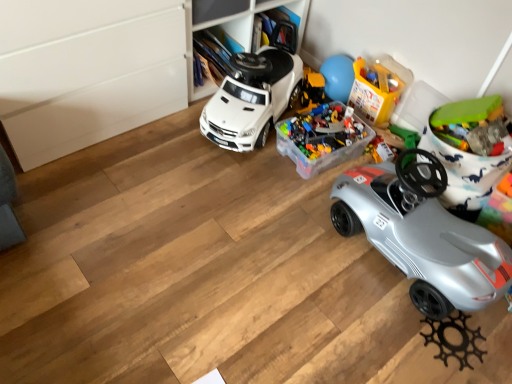
What do you see at coordinates (422, 234) in the screenshot?
I see `silver metallic car at lower right, placed as the first car when sorted from right to left` at bounding box center [422, 234].

The height and width of the screenshot is (384, 512). What do you see at coordinates (321, 156) in the screenshot? I see `translucent plastic container at center, which is counted as the third toy, starting from the right` at bounding box center [321, 156].

Describe the element at coordinates (378, 88) in the screenshot. The image size is (512, 384). I see `translucent plastic container at upper center, arranged as the 2th toy when viewed from the left` at that location.

The image size is (512, 384). I want to click on silver metallic car at lower right, placed as the first car when sorted from right to left, so click(422, 234).

Based on the photo, considering the positions of objects white matte toy car at center, positioned as the 2th car in right-to-left order, and silver metallic car at lower right, the 2th car viewed from the left, in the image provided, who is more to the left, white matte toy car at center, positioned as the 2th car in right-to-left order, or silver metallic car at lower right, the 2th car viewed from the left,?

Positioned to the left is white matte toy car at center, positioned as the 2th car in right-to-left order.

From the image's perspective, is white matte toy car at center, positioned as the 2th car in right-to-left order, located beneath silver metallic car at lower right, the 2th car viewed from the left?

No, from the image's perspective, white matte toy car at center, positioned as the 2th car in right-to-left order, is not below silver metallic car at lower right, the 2th car viewed from the left.

How far apart are white matte toy car at center, the 1th car positioned from the left, and silver metallic car at lower right, the 2th car viewed from the left?

white matte toy car at center, the 1th car positioned from the left, and silver metallic car at lower right, the 2th car viewed from the left, are 72.42 centimeters apart from each other.

From the image's perspective, between silver metallic car at lower right, the 2th car viewed from the left, and translucent plastic container at center, which is counted as the third toy, starting from the right, who is located below?

silver metallic car at lower right, the 2th car viewed from the left.

From a real-world perspective, which is physically above, silver metallic car at lower right, the 2th car viewed from the left, or translucent plastic container at center, the 1th toy positioned from the left?

silver metallic car at lower right, the 2th car viewed from the left.

Is silver metallic car at lower right, the 2th car viewed from the left, with translucent plastic container at center, the 1th toy positioned from the left?

They are not placed beside each other.

Is silver metallic car at lower right, placed as the first car when sorted from right to left, outside of translucent plastic container at center, which is counted as the third toy, starting from the right?

Yes, silver metallic car at lower right, placed as the first car when sorted from right to left, is located beyond the bounds of translucent plastic container at center, which is counted as the third toy, starting from the right.

In the scene shown: Looking at their sizes, would you say silver metallic car at lower right, the 2th car viewed from the left, is wider or thinner than green plastic toy at upper right, the first toy in the right-to-left sequence?

In the image, silver metallic car at lower right, the 2th car viewed from the left, appears to be wider than green plastic toy at upper right, the first toy in the right-to-left sequence.

Between silver metallic car at lower right, placed as the first car when sorted from right to left, and green plastic toy at upper right, marked as the third toy in a left-to-right arrangement, which one has smaller size?

green plastic toy at upper right, marked as the third toy in a left-to-right arrangement, is smaller.

The image size is (512, 384). Identify the location of car in front of the green plastic toy at upper right, the first toy in the right-to-left sequence. (422, 234).

Can green plastic toy at upper right, marked as the third toy in a left-to-right arrangement, be found inside silver metallic car at lower right, placed as the first car when sorted from right to left?

Definitely not — green plastic toy at upper right, marked as the third toy in a left-to-right arrangement, is not inside silver metallic car at lower right, placed as the first car when sorted from right to left.

Can you confirm if translucent plastic container at upper center, the 2th toy viewed from the right, is smaller than white matte toy car at center, the 1th car positioned from the left?

Yes, translucent plastic container at upper center, the 2th toy viewed from the right, is smaller than white matte toy car at center, the 1th car positioned from the left.

Would you say translucent plastic container at upper center, arranged as the 2th toy when viewed from the left, is inside or outside white matte toy car at center, positioned as the 2th car in right-to-left order?

translucent plastic container at upper center, arranged as the 2th toy when viewed from the left, exists outside the volume of white matte toy car at center, positioned as the 2th car in right-to-left order.

Is translucent plastic container at upper center, the 2th toy viewed from the right, shorter than white matte toy car at center, positioned as the 2th car in right-to-left order?

Yes, translucent plastic container at upper center, the 2th toy viewed from the right, is shorter than white matte toy car at center, positioned as the 2th car in right-to-left order.

Is translucent plastic container at center, which is counted as the third toy, starting from the right, with white matte toy car at center, the 1th car positioned from the left?

translucent plastic container at center, which is counted as the third toy, starting from the right, and white matte toy car at center, the 1th car positioned from the left, are clearly separated.

Where is `car on the left of the translucent plastic container at center, the 1th toy positioned from the left`? This screenshot has width=512, height=384. car on the left of the translucent plastic container at center, the 1th toy positioned from the left is located at coordinates (255, 93).

Is translucent plastic container at center, which is counted as the third toy, starting from the right, facing away from white matte toy car at center, positioned as the 2th car in right-to-left order?

No, translucent plastic container at center, which is counted as the third toy, starting from the right, is not facing the opposite direction of white matte toy car at center, positioned as the 2th car in right-to-left order.

Is point (360, 140) farther from viewer compared to point (263, 100)?

Yes, point (360, 140) is farther from viewer.

Based on the photo, is silver metallic car at lower right, placed as the first car when sorted from right to left, taller or shorter than translucent plastic container at upper center, arranged as the 2th toy when viewed from the left?

Clearly, silver metallic car at lower right, placed as the first car when sorted from right to left, is taller compared to translucent plastic container at upper center, arranged as the 2th toy when viewed from the left.

Which object is further away from the camera, silver metallic car at lower right, placed as the first car when sorted from right to left, or translucent plastic container at upper center, arranged as the 2th toy when viewed from the left?

translucent plastic container at upper center, arranged as the 2th toy when viewed from the left, is further away from the camera.

Is silver metallic car at lower right, the 2th car viewed from the left, aimed at translucent plastic container at upper center, the 2th toy viewed from the right?

No, silver metallic car at lower right, the 2th car viewed from the left, is not turned towards translucent plastic container at upper center, the 2th toy viewed from the right.

Looking at this image, which is nearer, (423, 285) or (373, 94)?

Clearly, point (423, 285) is closer to the camera than point (373, 94).

Where is `car in front of the white matte toy car at center, the 1th car positioned from the left`? car in front of the white matte toy car at center, the 1th car positioned from the left is located at coordinates (422, 234).

Could white matte toy car at center, positioned as the 2th car in right-to-left order, be considered to be inside silver metallic car at lower right, placed as the first car when sorted from right to left?

No.

This screenshot has height=384, width=512. In the image, there is a white matte toy car at center, positioned as the 2th car in right-to-left order. What are the coordinates of `car below it (from the image's perspective)` in the screenshot? It's located at pyautogui.click(x=422, y=234).

Find the location of a particular element. Image resolution: width=512 pixels, height=384 pixels. the 2nd toy behind the silver metallic car at lower right, the 2th car viewed from the left, counting from the anchor's position is located at coordinates (321, 156).

Which object lies nearer to the anchor point silver metallic car at lower right, placed as the first car when sorted from right to left, translucent plastic container at center, the 1th toy positioned from the left, or white matte toy car at center, the 1th car positioned from the left?

translucent plastic container at center, the 1th toy positioned from the left.

Based on their spatial positions, is silver metallic car at lower right, the 2th car viewed from the left, or green plastic toy at upper right, marked as the third toy in a left-to-right arrangement, further from translucent plastic container at center, which is counted as the third toy, starting from the right?

The object further to translucent plastic container at center, which is counted as the third toy, starting from the right, is green plastic toy at upper right, marked as the third toy in a left-to-right arrangement.

Estimate the real-world distances between objects in this image. Which object is closer to white matte toy car at center, the 1th car positioned from the left, translucent plastic container at upper center, the 2th toy viewed from the right, or silver metallic car at lower right, placed as the first car when sorted from right to left?

translucent plastic container at upper center, the 2th toy viewed from the right, lies closer to white matte toy car at center, the 1th car positioned from the left, than the other object.

When comparing their distances from translucent plastic container at upper center, the 2th toy viewed from the right, does silver metallic car at lower right, the 2th car viewed from the left, or white matte toy car at center, positioned as the 2th car in right-to-left order, seem closer?

white matte toy car at center, positioned as the 2th car in right-to-left order, lies closer to translucent plastic container at upper center, the 2th toy viewed from the right, than the other object.

When comparing their distances from green plastic toy at upper right, the first toy in the right-to-left sequence, does white matte toy car at center, the 1th car positioned from the left, or translucent plastic container at upper center, the 2th toy viewed from the right, seem closer?

Among the two, translucent plastic container at upper center, the 2th toy viewed from the right, is located nearer to green plastic toy at upper right, the first toy in the right-to-left sequence.

Estimate the real-world distances between objects in this image. Which object is closer to translucent plastic container at center, which is counted as the third toy, starting from the right, white matte toy car at center, the 1th car positioned from the left, or green plastic toy at upper right, the first toy in the right-to-left sequence?

white matte toy car at center, the 1th car positioned from the left.

Based on their spatial positions, is translucent plastic container at upper center, the 2th toy viewed from the right, or white matte toy car at center, the 1th car positioned from the left, further from silver metallic car at lower right, the 2th car viewed from the left?

Based on the image, white matte toy car at center, the 1th car positioned from the left, appears to be further to silver metallic car at lower right, the 2th car viewed from the left.

Considering their positions, is translucent plastic container at center, which is counted as the third toy, starting from the right, positioned further to white matte toy car at center, positioned as the 2th car in right-to-left order, than silver metallic car at lower right, the 2th car viewed from the left?

Based on the image, silver metallic car at lower right, the 2th car viewed from the left, appears to be further to white matte toy car at center, positioned as the 2th car in right-to-left order.

Find the location of a particular element. Image resolution: width=512 pixels, height=384 pixels. toy between translucent plastic container at center, which is counted as the third toy, starting from the right, and green plastic toy at upper right, the first toy in the right-to-left sequence is located at coordinates (378, 88).

Identify the location of car located between silver metallic car at lower right, the 2th car viewed from the left, and translucent plastic container at upper center, the 2th toy viewed from the right, in the depth direction. The width and height of the screenshot is (512, 384). (255, 93).

The height and width of the screenshot is (384, 512). I want to click on toy between white matte toy car at center, the 1th car positioned from the left, and translucent plastic container at upper center, the 2th toy viewed from the right, so click(321, 156).

Where is `car between silver metallic car at lower right, placed as the first car when sorted from right to left, and translucent plastic container at center, which is counted as the third toy, starting from the right, in the front-back direction`? Image resolution: width=512 pixels, height=384 pixels. car between silver metallic car at lower right, placed as the first car when sorted from right to left, and translucent plastic container at center, which is counted as the third toy, starting from the right, in the front-back direction is located at coordinates click(255, 93).